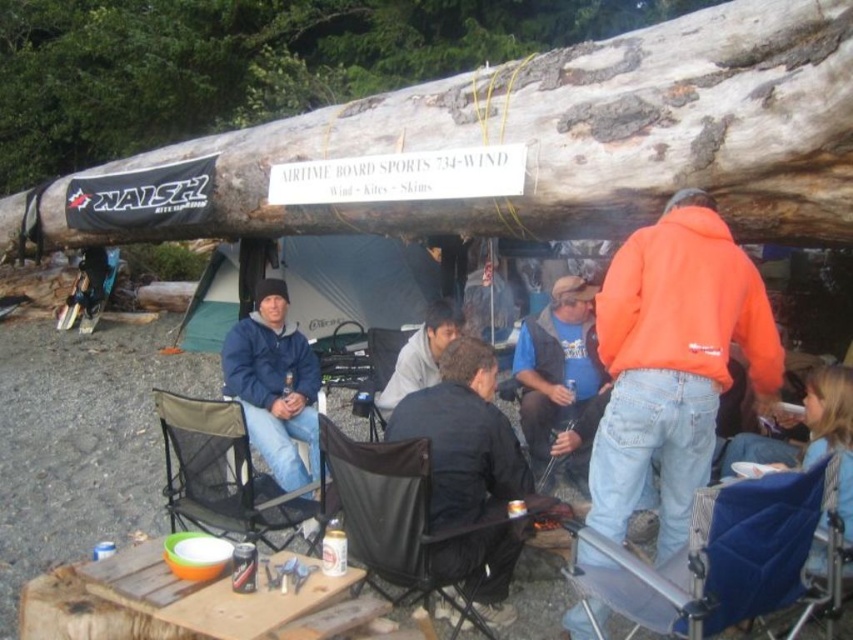
You are organizing an outdoor event and need to place a 2.5 meters long banner between the natural wood log at upper center and the blue fabric chair at lower right. Can the banner fit horizontally between them based on their widths?

The natural wood log at upper center is wider than the blue fabric chair at lower right. Since the banner is 2.5 meters long, it can fit horizontally between them as long as the combined width of both objects allows for the banner length. However, the exact spacing isn between them isn mentioned, so it depends on the distance between them.